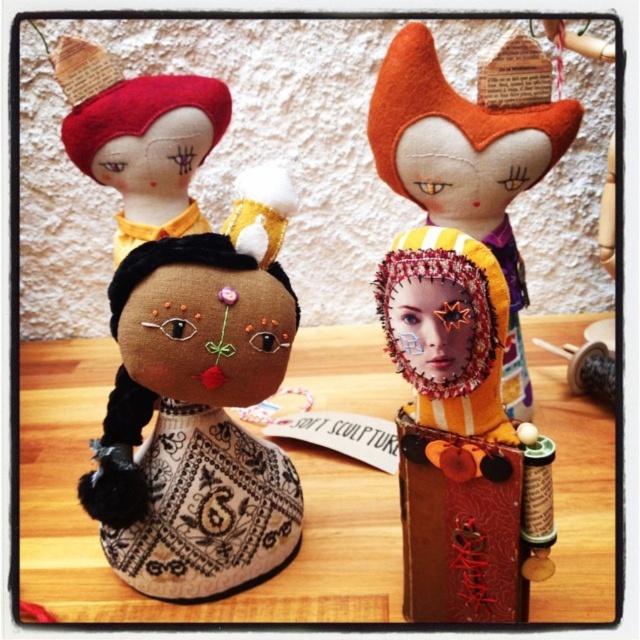
Does wooden table at center appear over textured fabric doll at center?

Yes, wooden table at center is above textured fabric doll at center.

Which is above, wooden table at center or textured fabric doll at center?

wooden table at center is higher up.

Where is `wooden table at center`? This screenshot has height=640, width=640. wooden table at center is located at coordinates (200, 604).

Does wooden table at center appear on the right side of brown fabric doll at center?

Indeed, wooden table at center is positioned on the right side of brown fabric doll at center.

Looking at this image, is wooden table at center smaller than brown fabric doll at center?

No, wooden table at center is not smaller than brown fabric doll at center.

Is point (77, 371) positioned before point (81, 493)?

No, it is not.

What are the coordinates of `wooden table at center` in the screenshot? It's located at (200, 604).

Which is behind, point (480, 296) or point (515, 328)?

The point (515, 328) is behind.

Between point (410, 339) and point (516, 416), which one is positioned in front?

Positioned in front is point (410, 339).

The height and width of the screenshot is (640, 640). What do you see at coordinates (452, 429) in the screenshot?
I see `textured fabric doll at center` at bounding box center [452, 429].

Where is `textured fabric doll at center`? textured fabric doll at center is located at coordinates (452, 429).